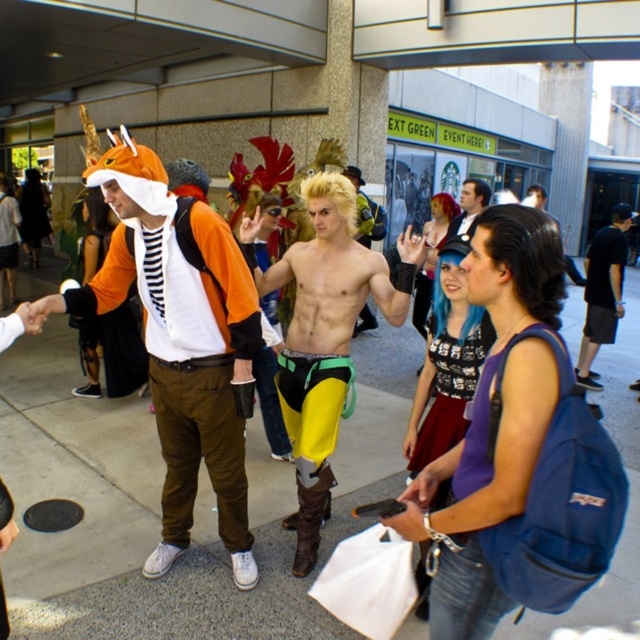
Question: Is orange fabric fox costume at left bigger than black cotton t-shirt at center?

Choices:
 (A) yes
 (B) no

Answer: (A)

Question: Based on their relative distances, which object is nearer to the black cotton t-shirt at center?

Choices:
 (A) orange fabric fox costume at left
 (B) shiny yellow pants at center

Answer: (B)

Question: Which point is closer to the camera?

Choices:
 (A) (214, 372)
 (B) (618, 310)
 (C) (348, 289)
 (D) (456, 221)

Answer: (A)

Question: Observing the image, what is the correct spatial positioning of orange fabric fox costume at left in reference to shiny yellow pants at center?

Choices:
 (A) above
 (B) below

Answer: (A)

Question: Which object is the farthest from the smooth black hair at center?

Choices:
 (A) shiny yellow pants at center
 (B) orange fabric fox costume at left
 (C) black cotton t-shirt at center

Answer: (B)

Question: Is shiny yellow pants at center to the right of black cotton t-shirt at center from the viewer's perspective?

Choices:
 (A) yes
 (B) no

Answer: (B)